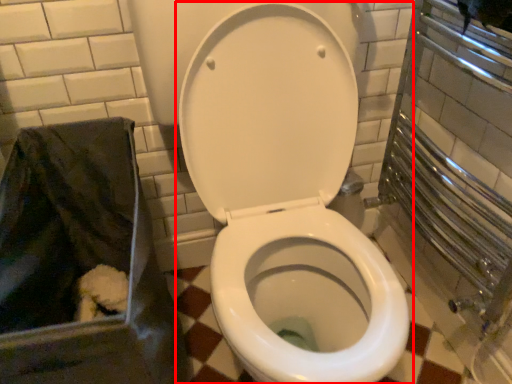
Question: From the image, what is the correct spatial relationship of toilet (annotated by the red box) in relation to recycling bin?

Choices:
 (A) right
 (B) left

Answer: (A)